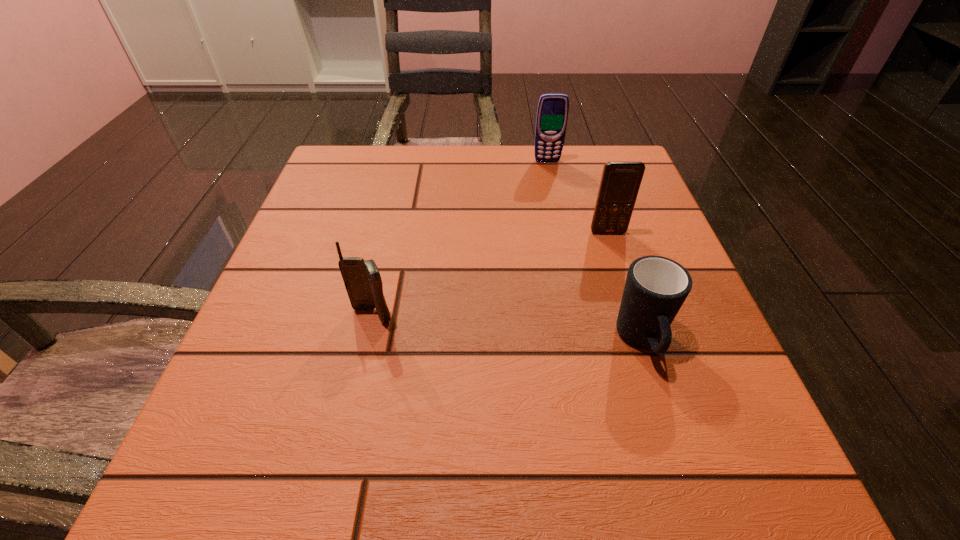
Image resolution: width=960 pixels, height=540 pixels. In order to click on free space at the near left corner in this screenshot , I will do (x=242, y=511).

At what (x,y) coordinates should I click in order to perform the action: click on vacant space at the far right corner. Please return your answer as a coordinate pair (x, y). The image size is (960, 540). Looking at the image, I should click on (611, 151).

Locate an element on the screen. The width and height of the screenshot is (960, 540). vacant space at the near right corner is located at coordinates (742, 485).

I want to click on vacant space that's between the nearest cellular telephone and the third nearest object, so click(x=490, y=274).

This screenshot has height=540, width=960. In order to click on vacant space in between the mug and the leftmost object in this screenshot , I will do `click(507, 328)`.

Locate an element on the screen. Image resolution: width=960 pixels, height=540 pixels. free space between the third object from right to left and the mug is located at coordinates [x=594, y=252].

Image resolution: width=960 pixels, height=540 pixels. Find the location of `blank region between the farthest cellular telephone and the nearest cellular telephone`. blank region between the farthest cellular telephone and the nearest cellular telephone is located at coordinates (459, 239).

Locate an element on the screen. free area in between the nearest cellular telephone and the farthest cellular telephone is located at coordinates (459, 239).

In order to click on vacant area that lies between the third nearest object and the leftmost cellular telephone in this screenshot , I will do `click(490, 274)`.

This screenshot has width=960, height=540. What are the coordinates of `free area in between the leftmost cellular telephone and the mug` in the screenshot? It's located at (507, 328).